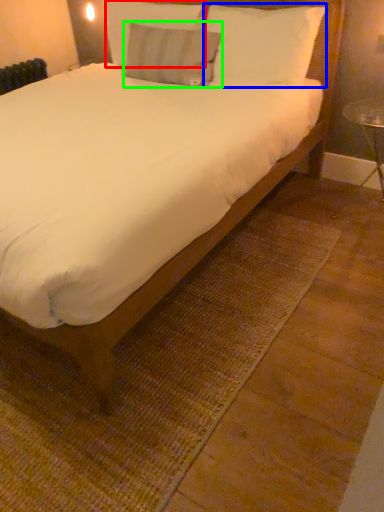
Question: Based on their relative distances, which object is farther from pillow (highlighted by a red box)? Choose from pillow (highlighted by a blue box) and pillow (highlighted by a green box).

Choices:
 (A) pillow
 (B) pillow

Answer: (A)